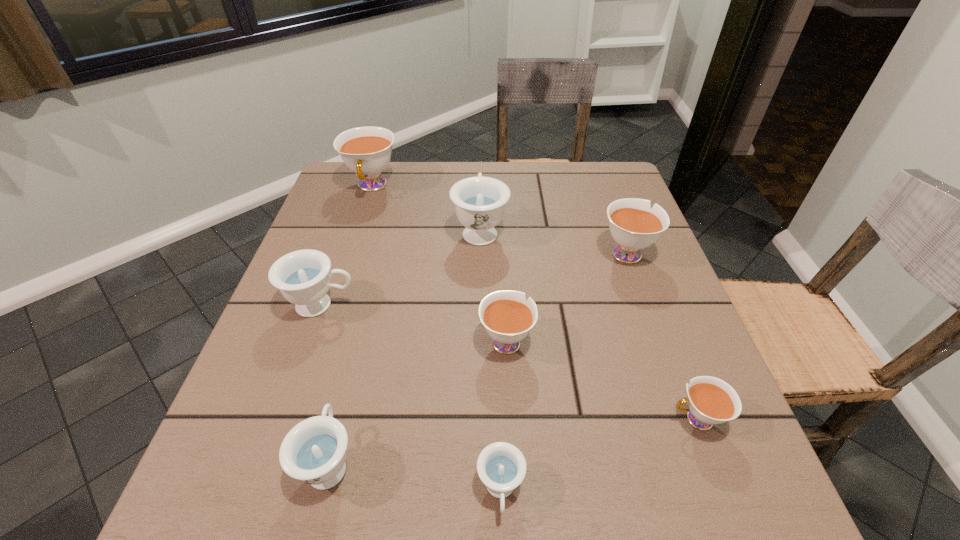
Identify the location of the biggest white teacup. The image size is (960, 540). (366, 151).

Find the location of `the leftmost white teacup`. the leftmost white teacup is located at coordinates (366, 151).

This screenshot has height=540, width=960. What are the coordinates of `the biggest blue teacup` in the screenshot? It's located at (479, 201).

Find the location of `the second biggest white teacup`. the second biggest white teacup is located at coordinates (634, 225).

Find the location of a particular element. the third nearest blue teacup is located at coordinates (302, 276).

Identify the location of the second nearest white teacup. The height and width of the screenshot is (540, 960). (507, 317).

Identify the location of the third biggest white teacup. This screenshot has height=540, width=960. (507, 317).

I want to click on the second smallest blue teacup, so click(x=314, y=451).

The image size is (960, 540). Find the location of `the nearest white teacup`. the nearest white teacup is located at coordinates (711, 400).

Image resolution: width=960 pixels, height=540 pixels. I want to click on the smallest blue teacup, so click(501, 466).